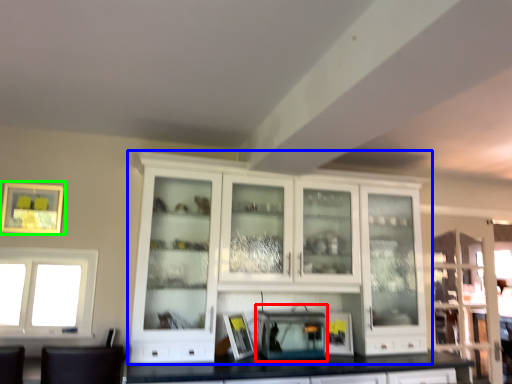
Question: Which is farther away from appliance (highlighted by a red box)? cabinetry (highlighted by a blue box) or picture frame (highlighted by a green box)?

Choices:
 (A) cabinetry
 (B) picture frame

Answer: (B)